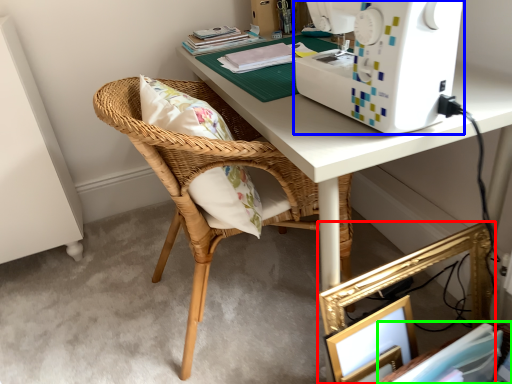
Question: Which object is the closest to the picture frame (highlighted by a red box)? Choose among these: sewing machine (highlighted by a blue box) or book (highlighted by a green box).

Choices:
 (A) sewing machine
 (B) book

Answer: (B)